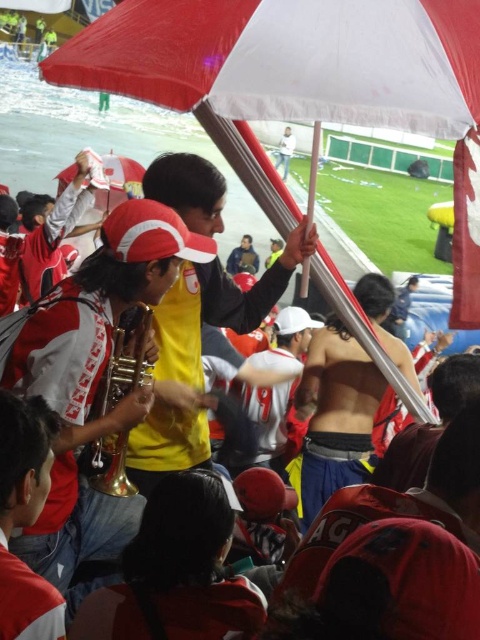
Is red and white fabric umbrella at center positioned before white matte shirt at upper center?

That is True.

Find the location of `red and white fabric umbrella at center`. red and white fabric umbrella at center is located at coordinates (288, 60).

Does yellow matte shirt at center have a greater width compared to white matte shirt at upper center?

Yes.

In the scene shown: Measure the distance from yellow matte shirt at center to white matte shirt at upper center.

yellow matte shirt at center is 175.74 feet away from white matte shirt at upper center.

I want to click on yellow matte shirt at center, so click(x=199, y=356).

Where is `yellow matte shirt at center`? The height and width of the screenshot is (640, 480). yellow matte shirt at center is located at coordinates (199, 356).

Which is above, red and white fabric umbrella at center or yellow matte shirt at center?

red and white fabric umbrella at center is higher up.

Which is in front, point (468, 90) or point (170, 348)?

Positioned in front is point (468, 90).

Is point (347, 19) behind point (168, 348)?

No, it is in front of (168, 348).

This screenshot has height=640, width=480. Find the location of `red and white fabric umbrella at center`. red and white fabric umbrella at center is located at coordinates pyautogui.click(x=288, y=60).